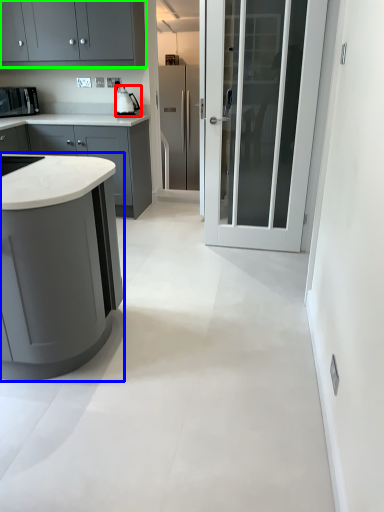
Question: Which object is positioned farthest from kitchen appliance (highlighted by a red box)? Select from cabinetry (highlighted by a blue box) and cabinetry (highlighted by a green box).

Choices:
 (A) cabinetry
 (B) cabinetry

Answer: (A)